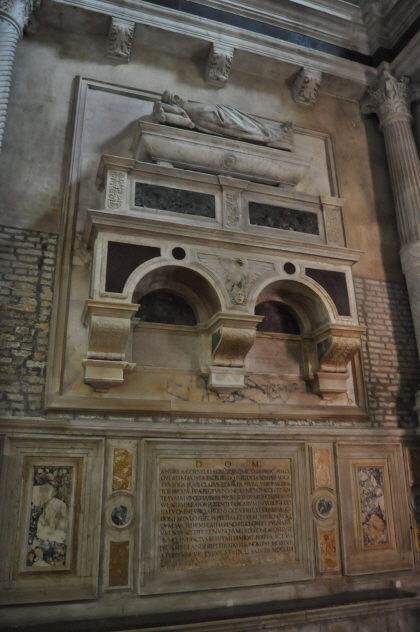
I want to click on stone jutting out from wall to hold up part of wall, so click(x=314, y=88), click(x=224, y=68), click(x=118, y=47).